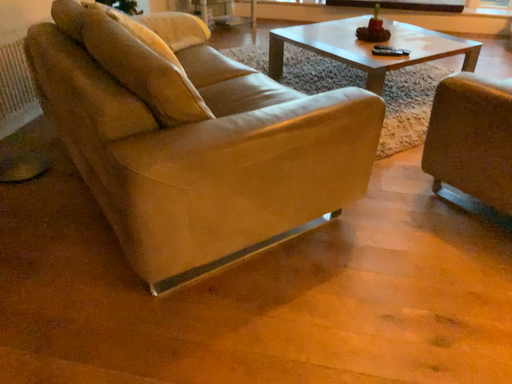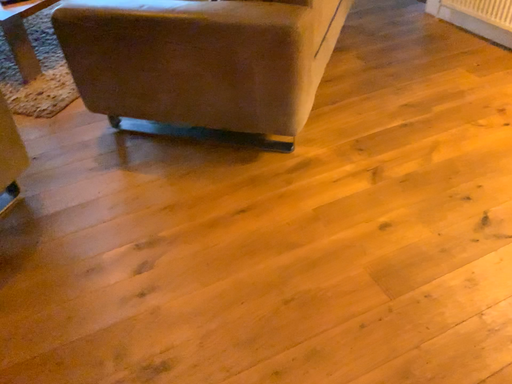
Question: How did the camera likely rotate when shooting the video?

Choices:
 (A) rotated right
 (B) rotated left

Answer: (A)